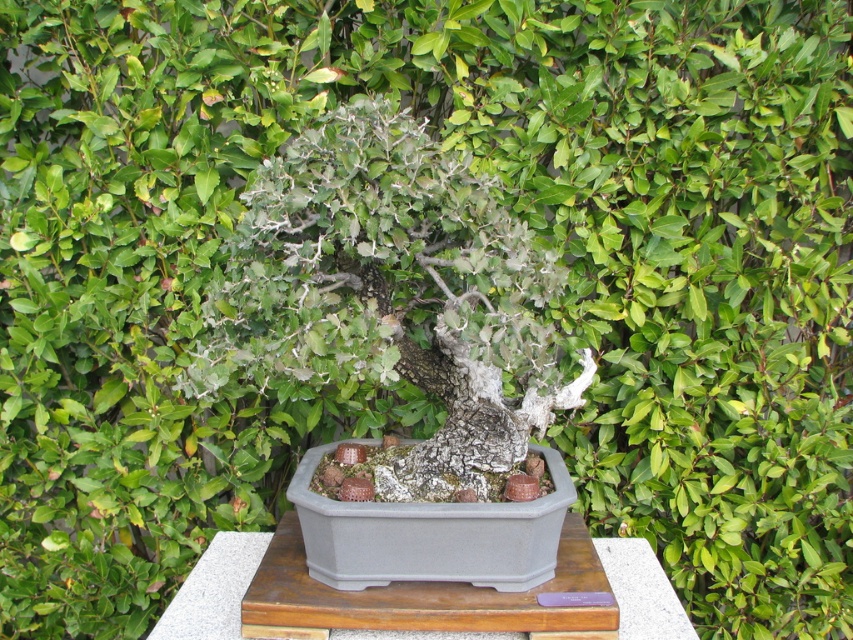
You are a gardener who wants to place a new decorative stone on the gray wood table at center. However, you notice the gray bark bonsai at center is nearby. Considering their sizes, will the bonsai block the view of the stone from above?

The gray bark bonsai at center is much taller than the gray wood table at center, so placing the stone on the table might be blocked by the bonsai from above.

You are a gardener standing 1.0 meters away from a bonsai tree. You want to water it without moving closer. Can you reach the gray bark bonsai at center from your current position?

The gray bark bonsai at center is 1.10 meters away from the viewer. Since you are standing 1.0 meters away, you are closer than the required distance, meaning you can easily reach it without needing to move closer.

You are an interior designer assessing the placement of the gray bark bonsai at center in a room. Based on its 2D coordinates, can you determine its position relative to the center of the room?

The gray bark bonsai at center is positioned very close to the center of the room since its coordinates are approximately 0.459 on the x and y axes, which are nearly halfway between 0 and 1, indicating it is almost centrally located.